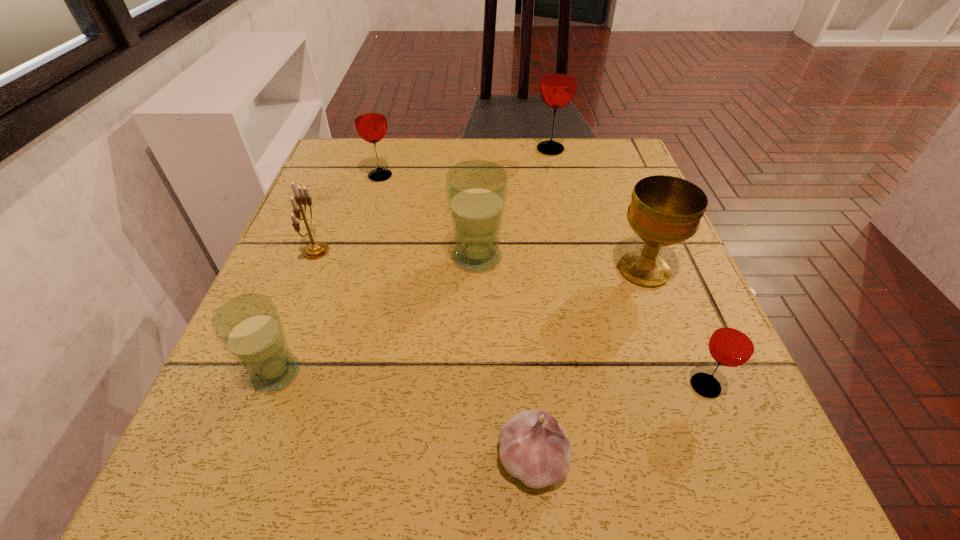
Identify the location of the second red glass from left to right. (558, 82).

Where is `the tallest glass`? The width and height of the screenshot is (960, 540). the tallest glass is located at coordinates (558, 82).

Where is `the fourth nearest glass`? the fourth nearest glass is located at coordinates tap(370, 121).

This screenshot has height=540, width=960. Identify the location of the leftmost red glass. (370, 121).

Identify the location of the bigger blue glass. pyautogui.click(x=476, y=190).

What are the coordinates of `the right blue glass` in the screenshot? It's located at (476, 190).

The image size is (960, 540). Identify the location of chalice. (664, 210).

Where is `gold candelabrum`? The height and width of the screenshot is (540, 960). gold candelabrum is located at coordinates (314, 250).

At what (x,y) coordinates should I click in order to perform the action: click on the smaller blue glass. Please return your answer as a coordinate pair (x, y). Image resolution: width=960 pixels, height=540 pixels. Looking at the image, I should click on (249, 327).

Locate an element on the screen. This screenshot has height=540, width=960. the nearer blue glass is located at coordinates click(249, 327).